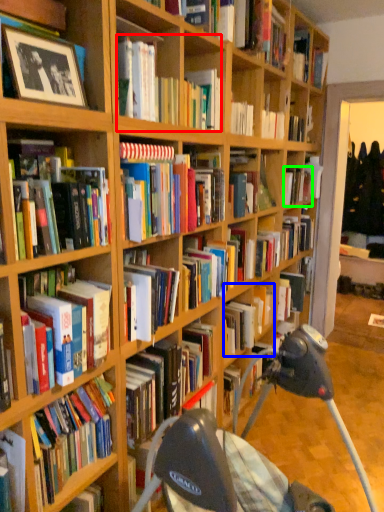
Question: Based on their relative distances, which object is nearer to book (highlighted by a red box)? Choose from book (highlighted by a blue box) and book (highlighted by a green box).

Choices:
 (A) book
 (B) book

Answer: (A)